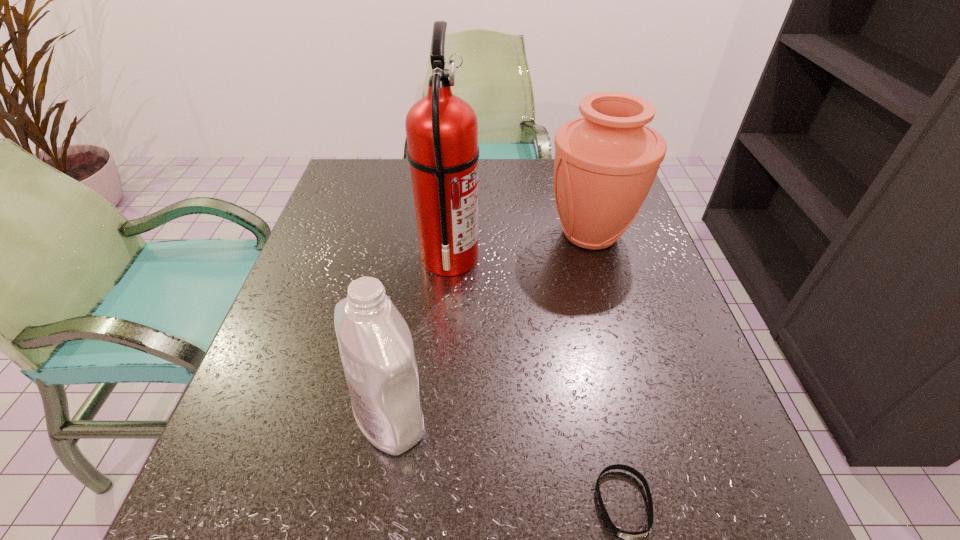
Identify the location of fire extinguisher. (441, 129).

What are the coordinates of `vase` in the screenshot? It's located at (605, 163).

Image resolution: width=960 pixels, height=540 pixels. I want to click on the second nearest object, so click(376, 348).

Where is `vacant area located 0.320m at the nozzle of the fire extinguisher`? The width and height of the screenshot is (960, 540). vacant area located 0.320m at the nozzle of the fire extinguisher is located at coordinates (621, 258).

Where is `vacant space situated 0.320m on the left of the vase`? The height and width of the screenshot is (540, 960). vacant space situated 0.320m on the left of the vase is located at coordinates (411, 234).

At what (x,y) coordinates should I click in order to perform the action: click on blank area located 0.110m on the left of the second nearest object. Please return your answer as a coordinate pair (x, y). The height and width of the screenshot is (540, 960). Looking at the image, I should click on (284, 418).

Locate an element on the screen. object that is at the right edge is located at coordinates (605, 163).

The image size is (960, 540). What are the coordinates of `vacant space at the near edge` in the screenshot? It's located at (433, 516).

In the image, there is a desktop. At what (x,y) coordinates should I click in order to perform the action: click on vacant area at the left edge. Please return your answer as a coordinate pair (x, y). Image resolution: width=960 pixels, height=540 pixels. Looking at the image, I should click on (299, 268).

Locate an element on the screen. The image size is (960, 540). free space at the right edge of the desktop is located at coordinates (636, 227).